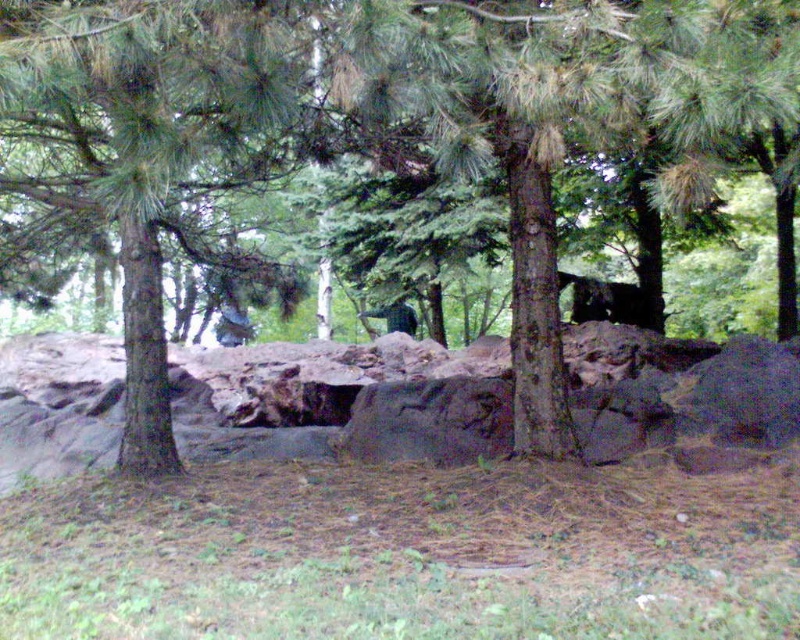
Who is shorter, brown rough tree at center or black furry bear at center?

black furry bear at center

Between brown rough tree at center and black furry bear at center, which one is positioned lower?

black furry bear at center is lower down.

Identify the location of brown rough tree at center. (362, 124).

Image resolution: width=800 pixels, height=640 pixels. I want to click on brown rough tree at center, so click(362, 124).

Is brown rough tree at center to the right of green matte bird at center from the viewer's perspective?

Yes, brown rough tree at center is to the right of green matte bird at center.

Which is below, brown rough tree at center or green matte bird at center?

green matte bird at center is below.

Find the location of a particular element. Image resolution: width=800 pixels, height=640 pixels. brown rough tree at center is located at coordinates (362, 124).

Which is behind, point (574, 308) or point (398, 314)?

The point (398, 314) is behind.

Does black furry bear at center have a greater width compared to green matte bird at center?

Indeed, black furry bear at center has a greater width compared to green matte bird at center.

Where is `black furry bear at center`? This screenshot has height=640, width=800. black furry bear at center is located at coordinates (608, 301).